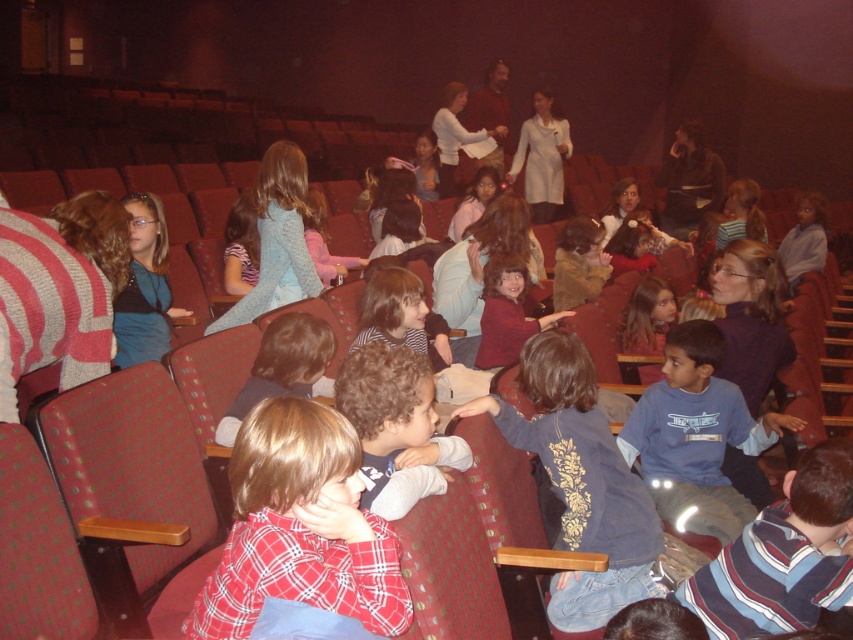
Question: Estimate the real-world distances between objects in this image. Which object is closer to the dark blue shirt with floral pattern at center?

Choices:
 (A) matte blue sweater at center
 (B) brown hair at center
 (C) matte blue shirt at center

Answer: (B)

Question: Which of the following is the closest to the observer?

Choices:
 (A) blue cotton shirt at center
 (B) striped cotton shirt at lower right
 (C) white sweater at center
 (D) matte black jacket at center

Answer: (B)

Question: Does brown hair at center have a larger size compared to matte brown jacket at center?

Choices:
 (A) no
 (B) yes

Answer: (A)

Question: Does red plaid shirt at center have a greater width compared to brown hair at center?

Choices:
 (A) yes
 (B) no

Answer: (A)

Question: Does curly-haired child at center have a lesser width compared to matte brown jacket at center?

Choices:
 (A) yes
 (B) no

Answer: (A)

Question: Estimate the real-world distances between objects in this image. Which object is closer to the red plaid shirt at center?

Choices:
 (A) white wool sweater at center
 (B) matte blue shirt at center

Answer: (B)